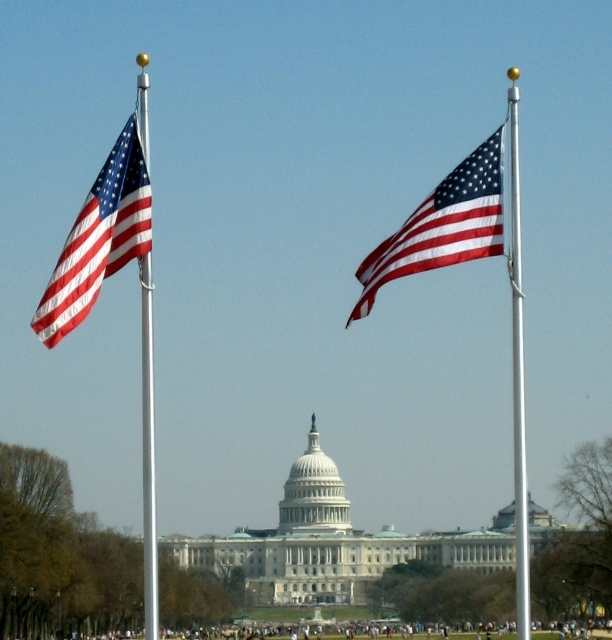
Question: Does shiny metallic flag at center come behind silver metallic flag pole at right?

Choices:
 (A) yes
 (B) no

Answer: (A)

Question: Which point is closer to the camera?

Choices:
 (A) polished silver flag pole at left
 (B) shiny metallic flag at center
 (C) matte fabric flag at left

Answer: (C)

Question: Does shiny metallic flag at center appear under polished silver flag pole at left?

Choices:
 (A) yes
 (B) no

Answer: (B)

Question: Does matte fabric flag at left appear on the left side of polished silver flag pole at left?

Choices:
 (A) no
 (B) yes

Answer: (B)

Question: Considering the real-world distances, which object is closest to the matte fabric flag at left?

Choices:
 (A) polished silver flag pole at left
 (B) silver metallic flag pole at right
 (C) shiny metallic flag at center

Answer: (A)

Question: Which point appears closest to the camera in this image?

Choices:
 (A) (520, 298)
 (B) (146, 83)

Answer: (A)